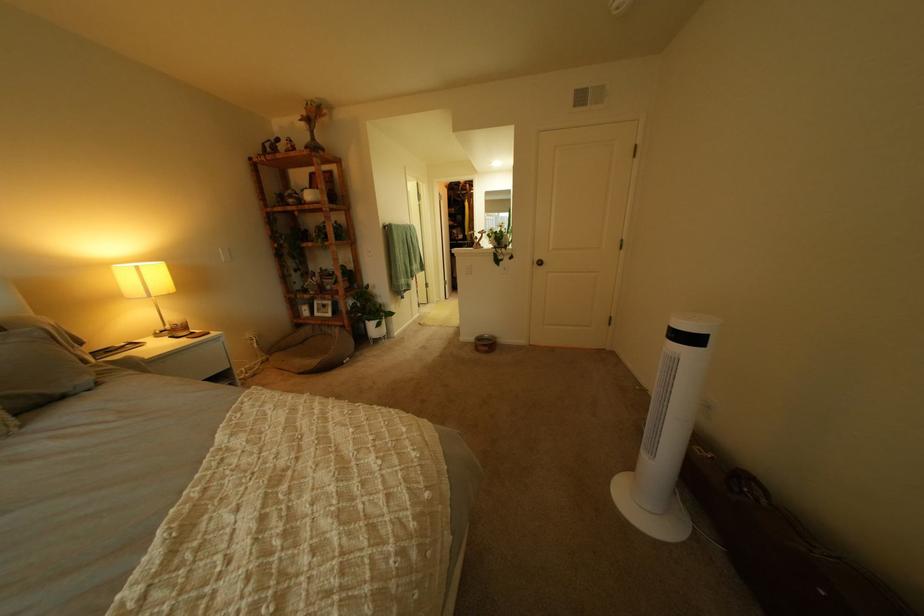
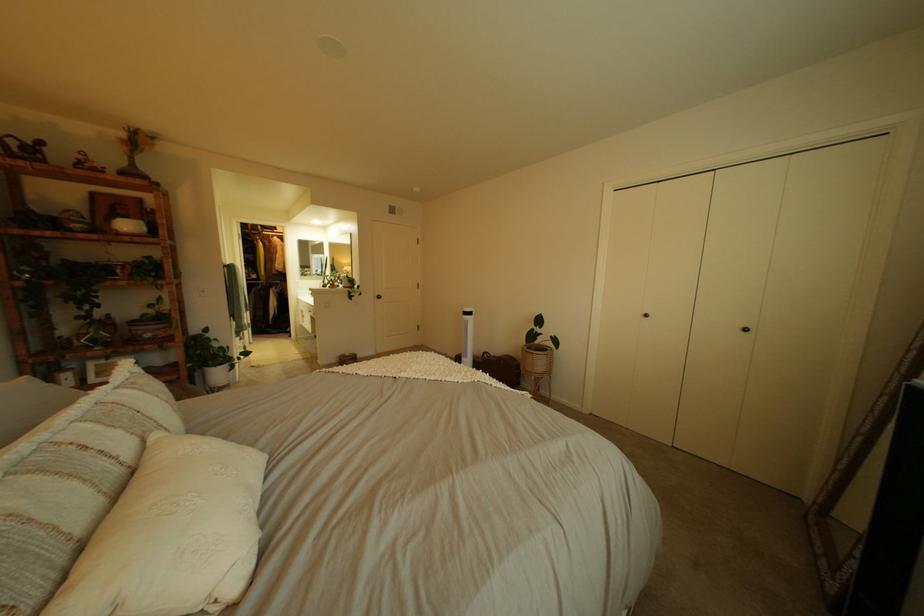
The point at (483, 187) is marked in the first image. Where is the corresponding point in the second image?

(274, 228)